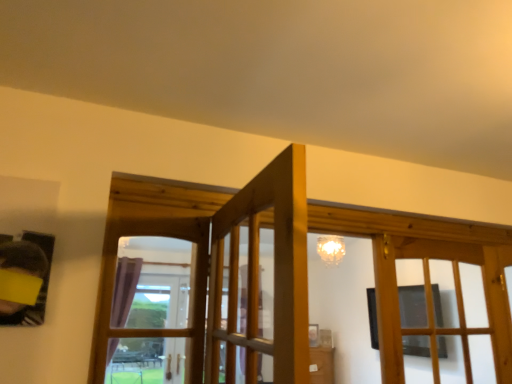
At what (x,y) coordinates should I click in order to perform the action: click on matte black screen door at right. Please return your answer as a coordinate pair (x, y). Image resolution: width=512 pixels, height=384 pixels. Looking at the image, I should click on (443, 311).

Describe the element at coordinates (443, 311) in the screenshot. Image resolution: width=512 pixels, height=384 pixels. I see `matte black screen door at right` at that location.

Image resolution: width=512 pixels, height=384 pixels. I want to click on matte black screen door at right, so click(x=443, y=311).